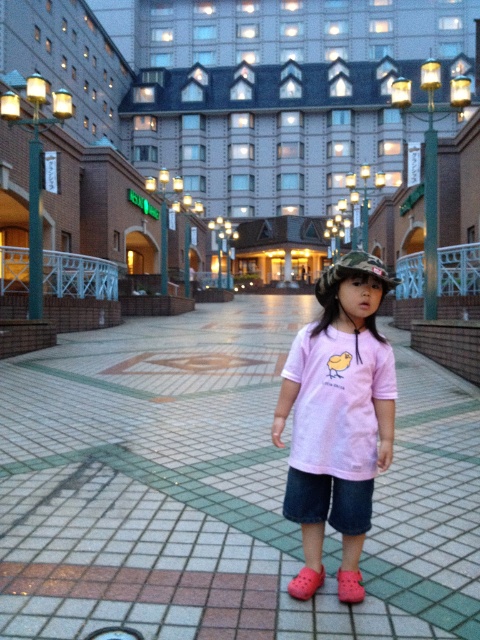
You are a photographer trying to capture the child in the plaza. You notice the pink cotton shirt at center and the pink rubber shoe at lower center. Which object is positioned more to the right side of the scene?

The pink cotton shirt at center is positioned to the right of the pink rubber shoe at lower center, so the pink cotton shirt at center is more to the right side of the scene.

Looking at this image, you are a photographer trying to capture the child in the plaza. You want to ensure the pink cotton shirt at center and pink matte shirt at center are both visible in the frame. Since the shirts have different widths, which one should you focus on to make sure both are fully visible without cropping?

The pink cotton shirt at center is wider than the pink matte shirt at center. To ensure both are fully visible without cropping, focus on framing the wider pink cotton shirt at center first, as it requires more space, and the narrower pink matte shirt at center will naturally fit within the same frame.

Looking at this image, you are a photographer trying to capture both the pink cotton shirt at center and the pink matte shirt at center in a single frame. Considering the distance between them, will you be able to fit both into your camera viewfinder without moving closer or further away?

The pink cotton shirt at center and the pink matte shirt at center are 60.88 meters apart from each other. Depending on your camera lens, this distance may require a wide angle lens to capture both in one frame without moving. However, standard lenses might struggle with such a large separation.